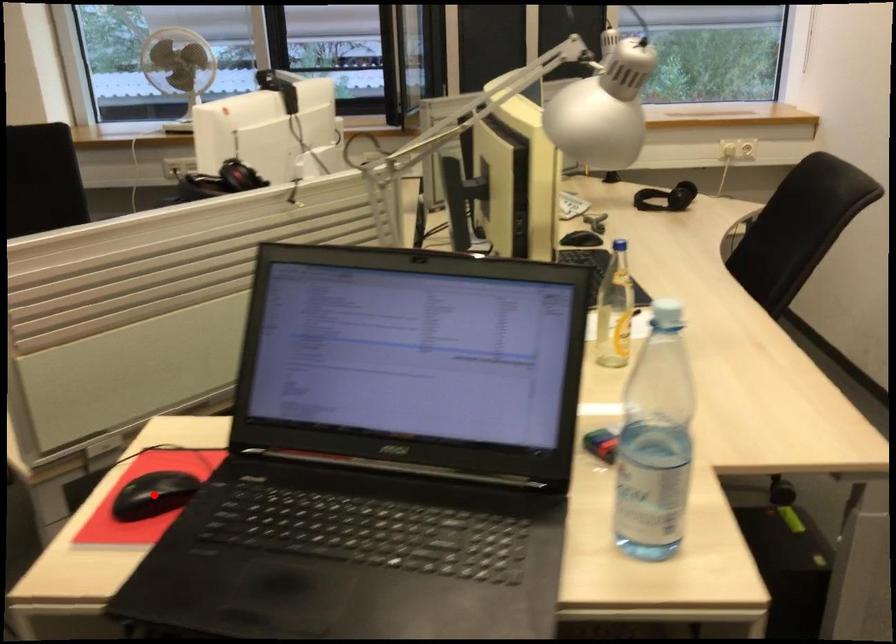
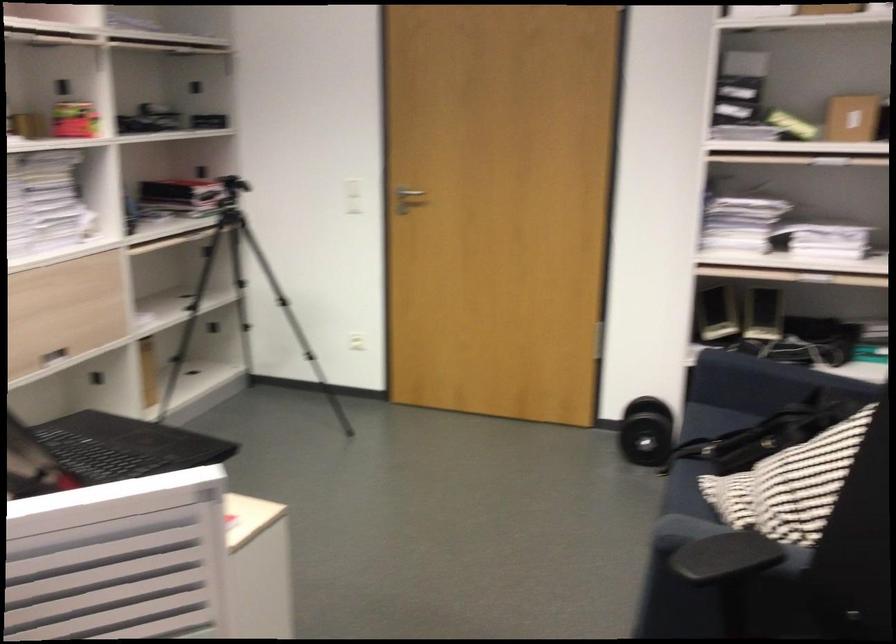
Question: I am providing you with two images of the same scene from different viewpoints. A red point is marked on the first image. Can you still see the location of the red point in image 2?

Choices:
 (A) Yes
 (B) No

Answer: (B)